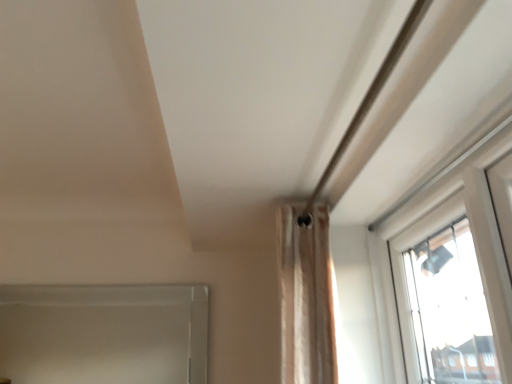
Question: Can you confirm if clear glass window frame at lower left is wider than beige fabric curtain at center?

Choices:
 (A) yes
 (B) no

Answer: (B)

Question: From the image's perspective, is clear glass window frame at lower left located beneath beige fabric curtain at center?

Choices:
 (A) yes
 (B) no

Answer: (A)

Question: Is clear glass window frame at lower left thinner than beige fabric curtain at center?

Choices:
 (A) yes
 (B) no

Answer: (A)

Question: Is clear glass window frame at lower left not near beige fabric curtain at center?

Choices:
 (A) yes
 (B) no

Answer: (A)

Question: Is clear glass window frame at lower left beside beige fabric curtain at center?

Choices:
 (A) no
 (B) yes

Answer: (A)

Question: Is clear glass window frame at lower left aimed at beige fabric curtain at center?

Choices:
 (A) yes
 (B) no

Answer: (A)

Question: Does beige fabric curtain at center have a lesser height compared to clear glass window frame at lower left?

Choices:
 (A) yes
 (B) no

Answer: (B)

Question: Is there a large distance between beige fabric curtain at center and clear glass window frame at lower left?

Choices:
 (A) no
 (B) yes

Answer: (B)

Question: Considering the relative positions of beige fabric curtain at center and clear glass window frame at lower left in the image provided, is beige fabric curtain at center behind clear glass window frame at lower left?

Choices:
 (A) no
 (B) yes

Answer: (A)

Question: From a real-world perspective, is beige fabric curtain at center positioned over clear glass window frame at lower left based on gravity?

Choices:
 (A) no
 (B) yes

Answer: (B)

Question: Is beige fabric curtain at center to the right of clear glass window frame at lower left from the viewer's perspective?

Choices:
 (A) no
 (B) yes

Answer: (B)

Question: From the image's perspective, is beige fabric curtain at center beneath clear glass window frame at lower left?

Choices:
 (A) no
 (B) yes

Answer: (A)

Question: Is point (296, 244) closer or farther from the camera than point (106, 326)?

Choices:
 (A) farther
 (B) closer

Answer: (B)